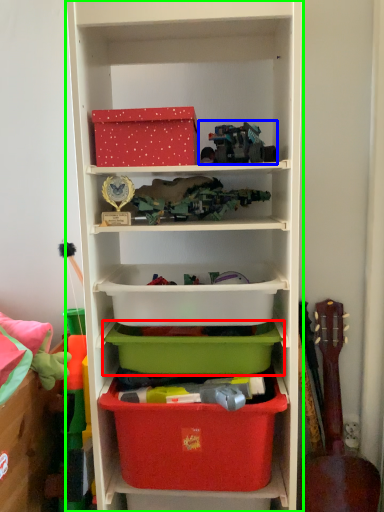
Question: Estimate the real-world distances between objects in this image. Which object is closer to storage box (highlighted by a red box), toy (highlighted by a blue box) or shelf (highlighted by a green box)?

Choices:
 (A) toy
 (B) shelf

Answer: (B)